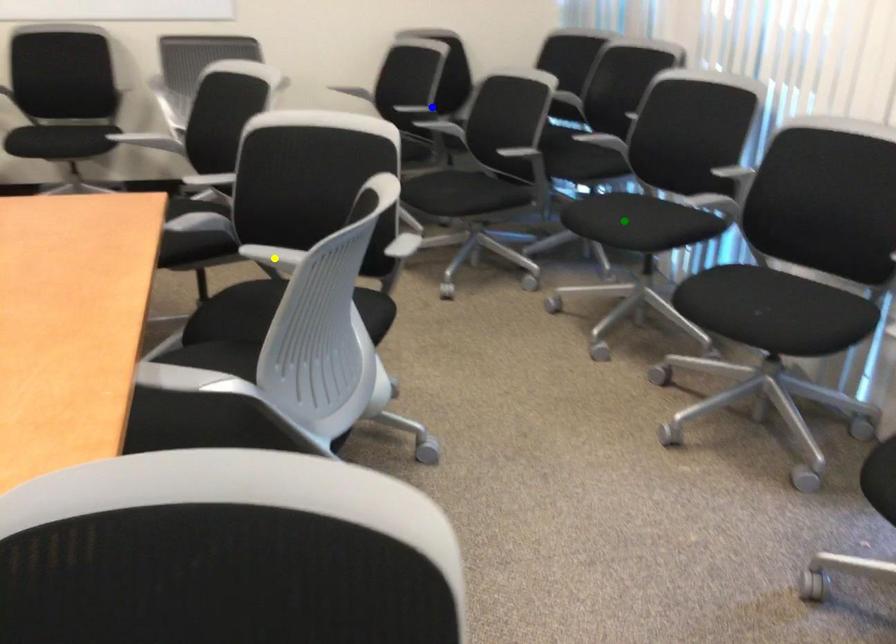
Order these from farthest to nearest:
blue point, green point, yellow point

blue point < green point < yellow point